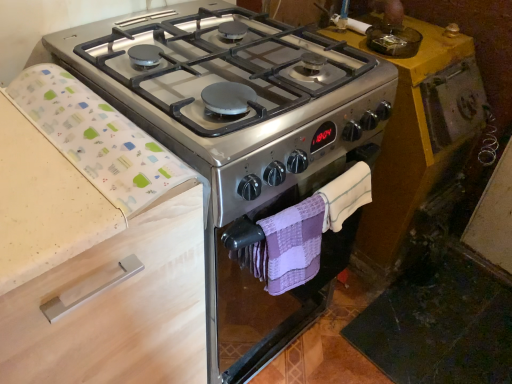
Question: From the image's perspective, relative to beige wood drawer at left, is white fabric at left above or below?

Choices:
 (A) above
 (B) below

Answer: (A)

Question: Visually, is white fabric at left positioned to the left or to the right of beige wood drawer at left?

Choices:
 (A) left
 (B) right

Answer: (B)

Question: Which of these objects is positioned closest to the purple woven hand towel at lower center, which is the 1th hand towel in left-to-right order?

Choices:
 (A) white fabric at left
 (B) beige wood drawer at left
 (C) purple woven hand towel at center, the 2th hand towel viewed from the left
 (D) satin silver gas stove at center

Answer: (C)

Question: Which is nearer to the purple woven hand towel at lower center, which is the second hand towel from right to left?

Choices:
 (A) white fabric at left
 (B) purple woven hand towel at center, the 2th hand towel viewed from the left
 (C) satin silver gas stove at center
 (D) beige wood drawer at left

Answer: (B)